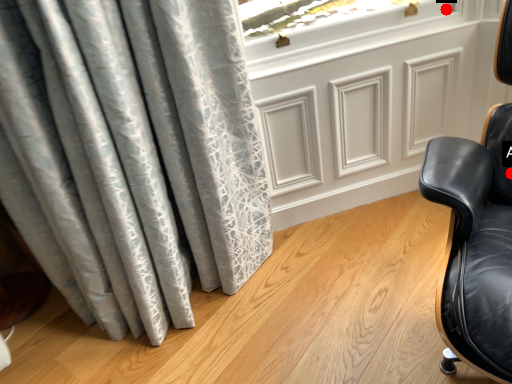
Question: Two points are circled on the image, labeled by A and B beside each circle. Which point appears farthest from the camera in this image?

Choices:
 (A) A is further
 (B) B is further

Answer: (B)